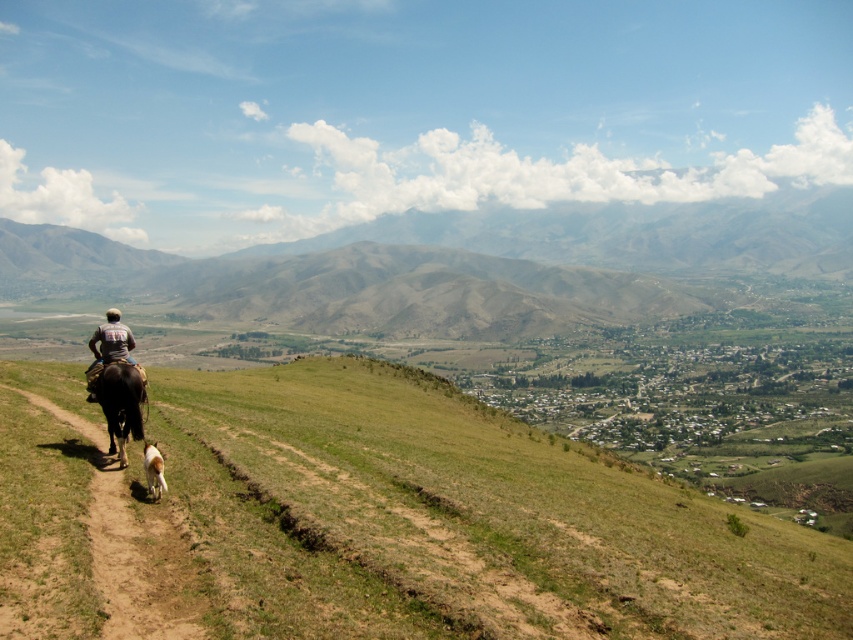
Question: Estimate the real-world distances between objects in this image. Which object is closer to the black glossy horse at lower left?

Choices:
 (A) green grassy hill at center
 (B) brown dirt path at lower left
 (C) dark brown leather jacket at left
 (D) white fur dog at lower left

Answer: (C)

Question: Which object is closer to the camera taking this photo?

Choices:
 (A) green grassy hillside at center
 (B) white fur dog at lower left

Answer: (A)

Question: Based on their relative distances, which object is farther from the dark brown leather jacket at left?

Choices:
 (A) black glossy horse at lower left
 (B) green grassy hillside at center

Answer: (B)

Question: Does dark brown leather jacket at left have a smaller size compared to white fur dog at lower left?

Choices:
 (A) yes
 (B) no

Answer: (B)

Question: Where is green grassy hill at center located in relation to brown dirt path at lower left in the image?

Choices:
 (A) right
 (B) left

Answer: (A)

Question: Is dark brown leather jacket at left to the left of white fur dog at lower left from the viewer's perspective?

Choices:
 (A) yes
 (B) no

Answer: (A)